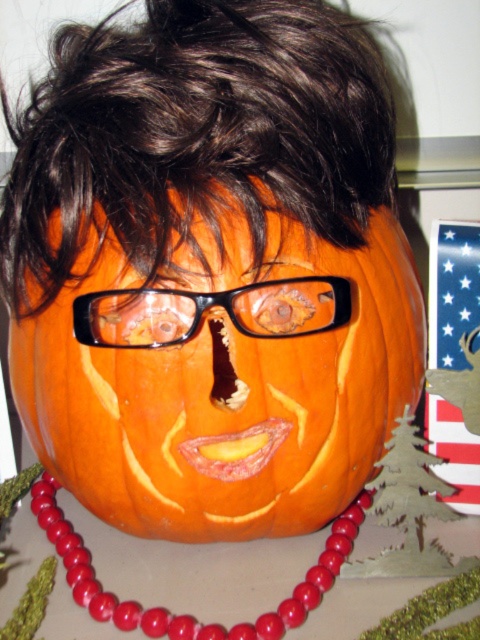
Who is positioned more to the right, orange carved pumpkin at center or red beads at center?

From the viewer's perspective, orange carved pumpkin at center appears more on the right side.

Can you confirm if orange carved pumpkin at center is wider than red beads at center?

Yes, orange carved pumpkin at center is wider than red beads at center.

Which is behind, point (187, 480) or point (332, 550)?

Point (332, 550)

This screenshot has width=480, height=640. In order to click on orange carved pumpkin at center in this screenshot , I will do `click(223, 372)`.

Can you confirm if orange carved pumpkin at center is positioned below dark brown hair at upper center?

Answer: Indeed, orange carved pumpkin at center is positioned under dark brown hair at upper center.

Does point (313, 260) lie in front of point (69, 163)?

No.

Between point (58, 308) and point (39, 296), which one is positioned behind?

Point (39, 296)

Find the location of a particular element. orange carved pumpkin at center is located at coordinates (223, 372).

Which is behind, point (365, 202) or point (95, 586)?

The point (365, 202) is behind.

Where is `dark brown hair at upper center`? Image resolution: width=480 pixels, height=640 pixels. dark brown hair at upper center is located at coordinates (194, 132).

The height and width of the screenshot is (640, 480). I want to click on dark brown hair at upper center, so click(194, 132).